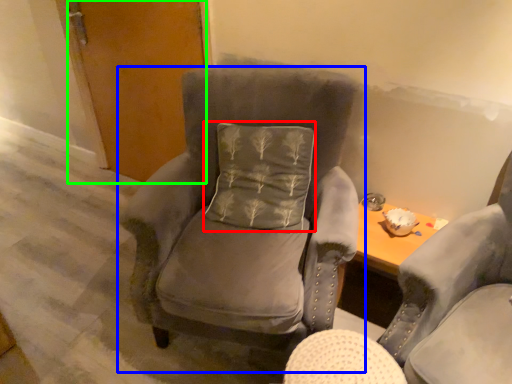
Question: Which is nearer to the pillow (highlighted by a red box)? chair (highlighted by a blue box) or door (highlighted by a green box).

Choices:
 (A) chair
 (B) door

Answer: (A)